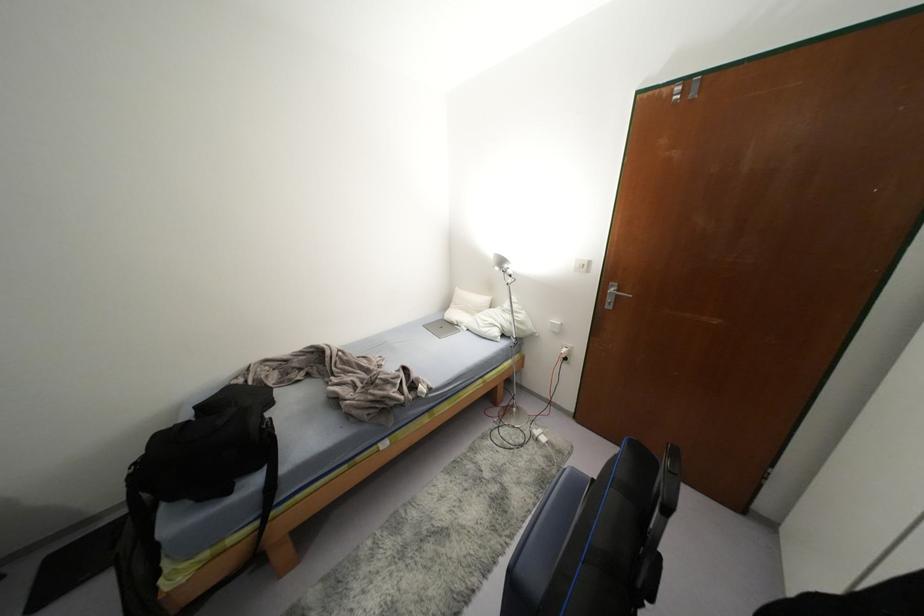
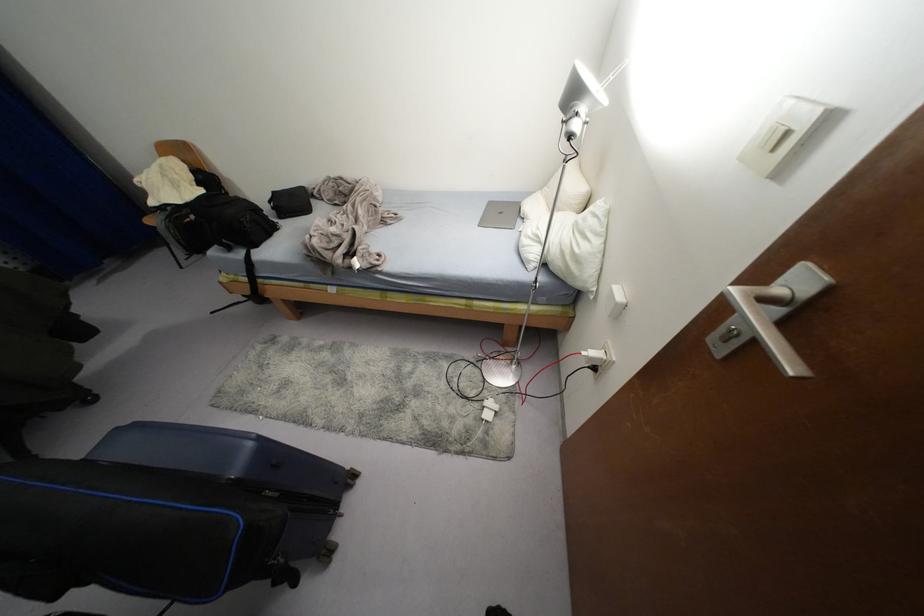
Find the pixel in the second image that matches point (564, 350) in the first image.

(592, 353)